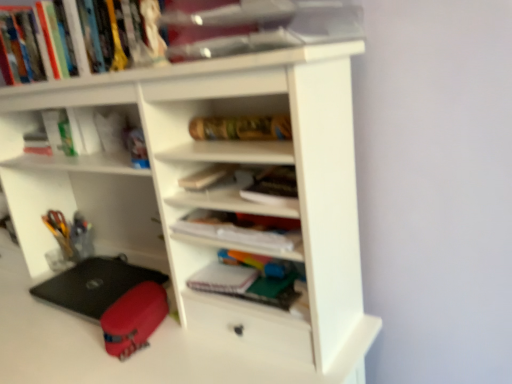
At what (x,y) coordinates should I click in order to perform the action: click on vacant area on top of black matte laptop at lower left (from a real-world perspective). Please return your answer as a coordinate pair (x, y). Looking at the image, I should click on (95, 280).